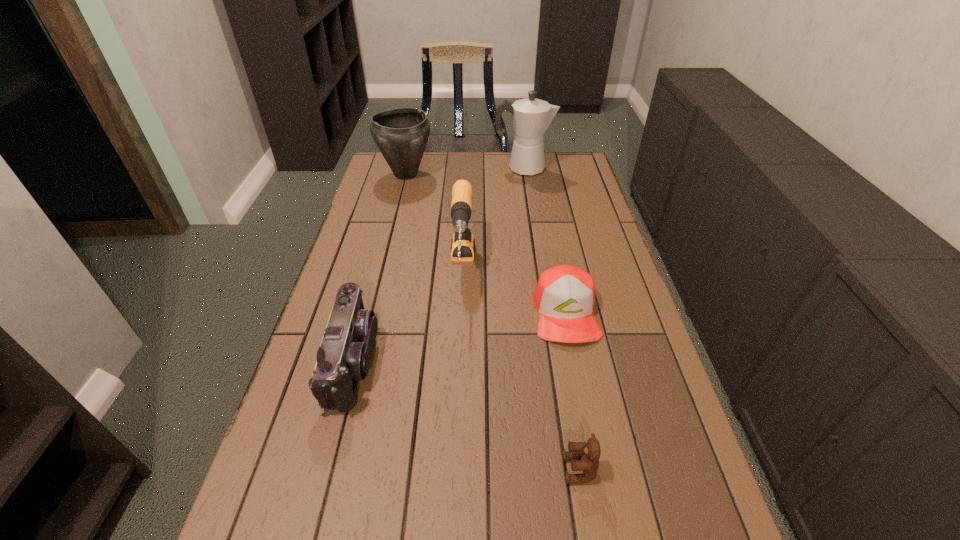
Where is `the tallest object`? the tallest object is located at coordinates pos(531,117).

This screenshot has height=540, width=960. I want to click on urn, so [x=401, y=134].

At what (x,y) coordinates should I click in order to perform the action: click on the third object from left to right. Please return your answer as a coordinate pair (x, y). The image size is (960, 540). Looking at the image, I should click on (463, 243).

Image resolution: width=960 pixels, height=540 pixels. What are the coordinates of `the fourth tallest object` in the screenshot? It's located at (345, 352).

Identify the location of baseball cap. (564, 297).

Identify the location of the nearest object. (584, 456).

Identify the location of free space located on the left of the coffeepot. (462, 168).

This screenshot has height=540, width=960. I want to click on vacant position located on the front of the urn, so click(386, 257).

This screenshot has height=540, width=960. What are the coordinates of `vacant space located 0.070m on the handle side of the drill` in the screenshot? It's located at (460, 330).

Identify the location of blank space located 0.370m on the front-facing side of the third shortest object. The height and width of the screenshot is (540, 960). tap(538, 362).